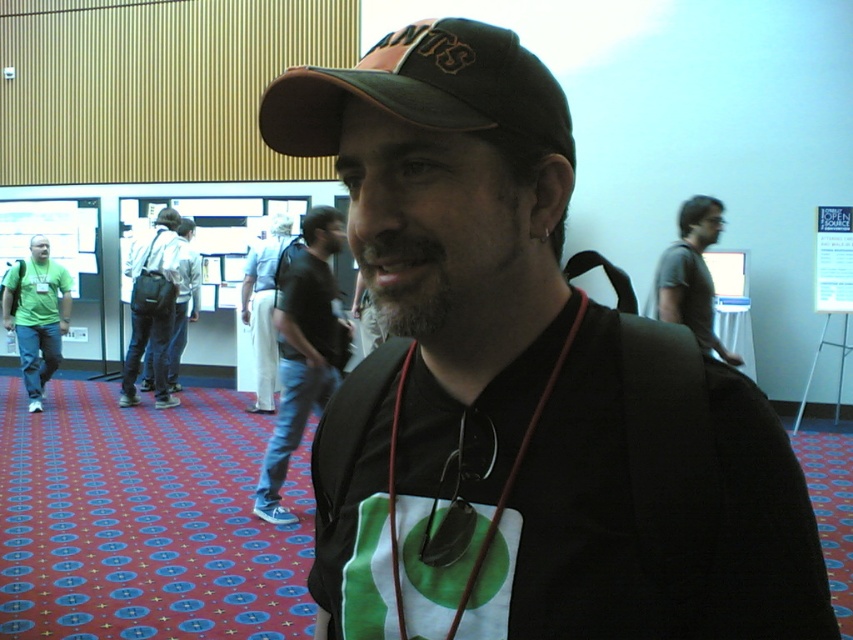
Which is below, black matte neck at center or denim jeans at center?

Positioned lower is denim jeans at center.

Which is behind, point (554, 289) or point (190, 296)?

Point (190, 296)

Locate an element on the screen. The width and height of the screenshot is (853, 640). black matte neck at center is located at coordinates (485, 305).

Is point (486, 308) positioned after point (654, 314)?

No, it is not.

Who is lower down, black matte neck at center or gray cotton shirt at center?

black matte neck at center

Does point (488, 284) come closer to viewer compared to point (679, 273)?

Yes, it is in front of point (679, 273).

I want to click on black matte neck at center, so (x=485, y=305).

Who is higher up, gray cotton shirt at center or white cotton pants at center?

gray cotton shirt at center

Is gray cotton shirt at center shorter than white cotton pants at center?

Indeed, gray cotton shirt at center has a lesser height compared to white cotton pants at center.

Does point (675, 296) lie behind point (276, 234)?

No, (675, 296) is in front of (276, 234).

You are a GUI agent. You are given a task and a screenshot of the screen. Output one action in this format:
    pyautogui.click(x=<x>, y=<y>)
    Task: Click on the gray cotton shirt at center
    The width and height of the screenshot is (853, 640).
    Given the screenshot: What is the action you would take?
    pyautogui.click(x=689, y=275)